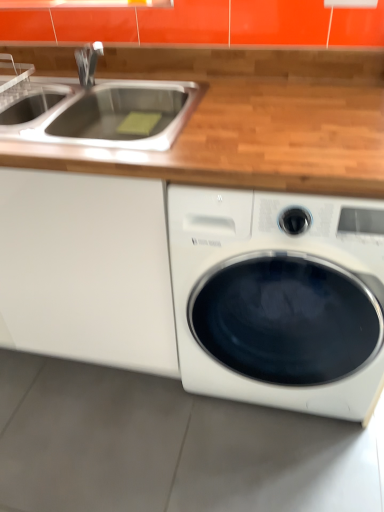
Question: Is white matte cabinet at left looking in the opposite direction of white glossy washing machine at lower right?

Choices:
 (A) no
 (B) yes

Answer: (A)

Question: Can you confirm if white matte cabinet at left is positioned to the right of white glossy washing machine at lower right?

Choices:
 (A) yes
 (B) no

Answer: (B)

Question: From a real-world perspective, is white matte cabinet at left under white glossy washing machine at lower right?

Choices:
 (A) no
 (B) yes

Answer: (B)

Question: From the image's perspective, is white matte cabinet at left on top of white glossy washing machine at lower right?

Choices:
 (A) no
 (B) yes

Answer: (B)

Question: Is white matte cabinet at left closer to camera compared to white glossy washing machine at lower right?

Choices:
 (A) yes
 (B) no

Answer: (B)

Question: Is white matte cabinet at left behind white glossy washing machine at lower right?

Choices:
 (A) no
 (B) yes

Answer: (B)

Question: Can you confirm if stainless steel sink at upper left is taller than white matte cabinet at left?

Choices:
 (A) no
 (B) yes

Answer: (A)

Question: Is stainless steel sink at upper left smaller than white matte cabinet at left?

Choices:
 (A) no
 (B) yes

Answer: (B)

Question: From a real-world perspective, is stainless steel sink at upper left on white matte cabinet at left?

Choices:
 (A) no
 (B) yes

Answer: (B)

Question: Is stainless steel sink at upper left to the right of white matte cabinet at left from the viewer's perspective?

Choices:
 (A) yes
 (B) no

Answer: (A)

Question: Is stainless steel sink at upper left shorter than white matte cabinet at left?

Choices:
 (A) no
 (B) yes

Answer: (B)

Question: Is white matte cabinet at left at the back of stainless steel sink at upper left?

Choices:
 (A) yes
 (B) no

Answer: (A)

Question: Is stainless steel sink at upper left positioned behind white glossy washing machine at lower right?

Choices:
 (A) yes
 (B) no

Answer: (A)